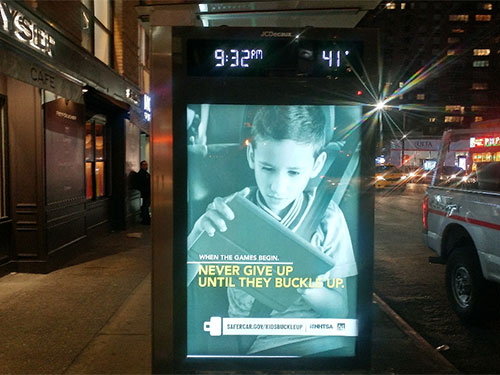
In order to click on windows in this screenshot , I will do `click(102, 39)`, `click(104, 14)`, `click(99, 146)`.